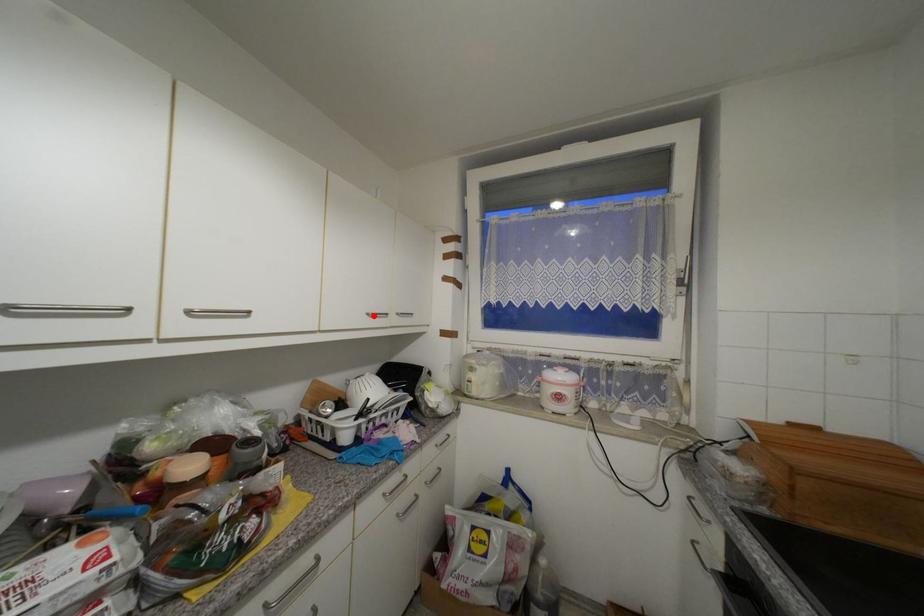
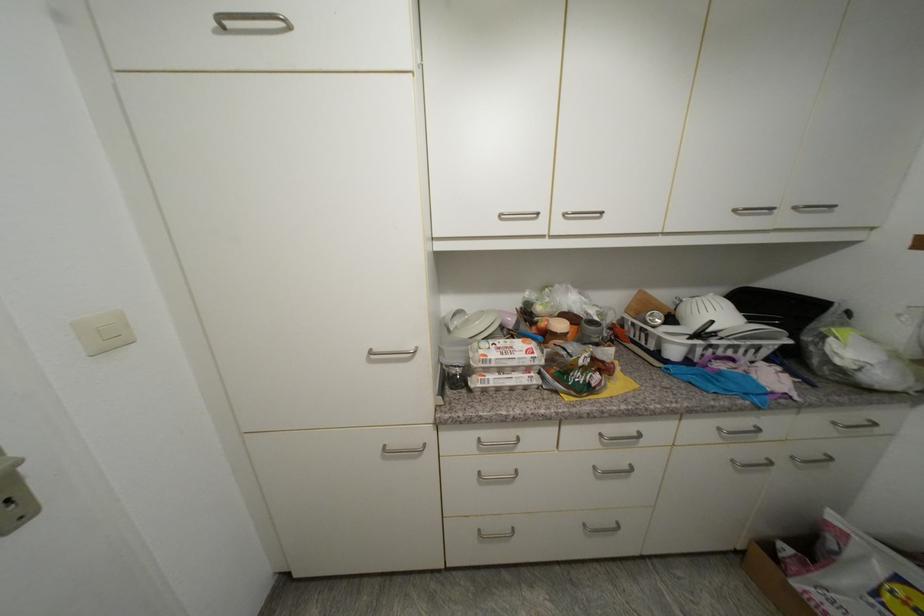
In the second image, find the point that corresponds to the highlighted location in the first image.

(740, 213)